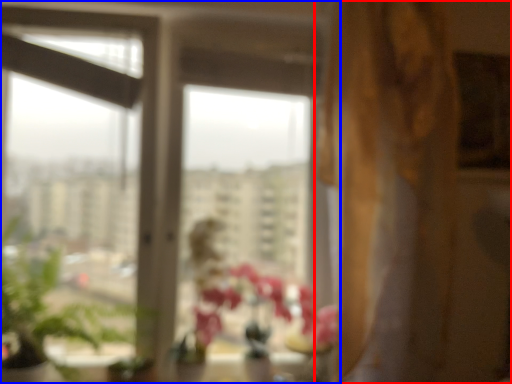
Question: Among these objects, which one is farthest to the camera, curtain (highlighted by a red box) or window (highlighted by a blue box)?

Choices:
 (A) curtain
 (B) window

Answer: (B)